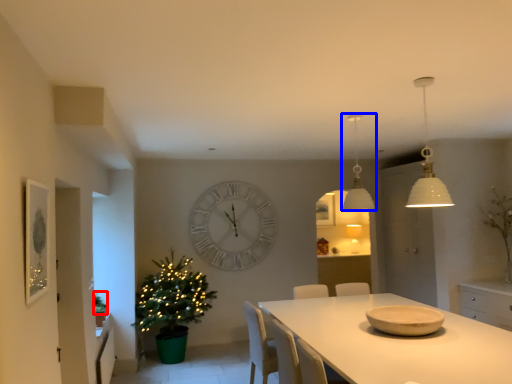
Question: Which of the following is the farthest to the observer, plant (highlighted by a red box) or lamp (highlighted by a blue box)?

Choices:
 (A) plant
 (B) lamp

Answer: (A)